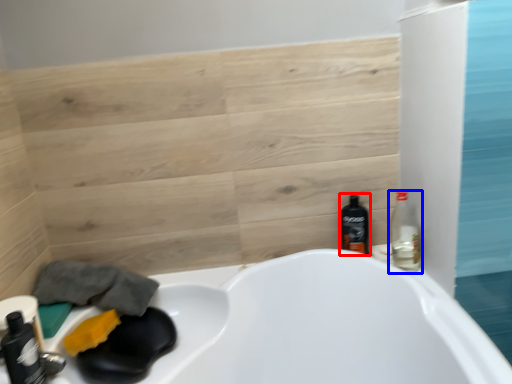
Question: Which object is further to the camera taking this photo, bottle (highlighted by a red box) or bottle (highlighted by a blue box)?

Choices:
 (A) bottle
 (B) bottle

Answer: (A)